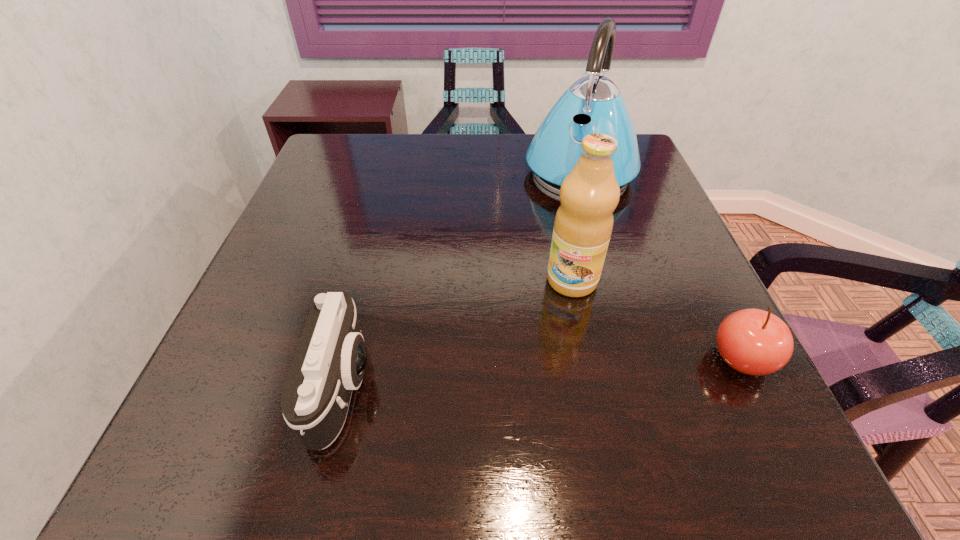
Locate an element on the screen. This screenshot has width=960, height=540. vacant space on the desktop that is between the camera and the apple and is positioned on the label of the olive oil is located at coordinates (527, 373).

Where is `free space on the desktop that is between the camera and the shortest object and is positioned at the spout of the kettle`? free space on the desktop that is between the camera and the shortest object and is positioned at the spout of the kettle is located at coordinates (492, 375).